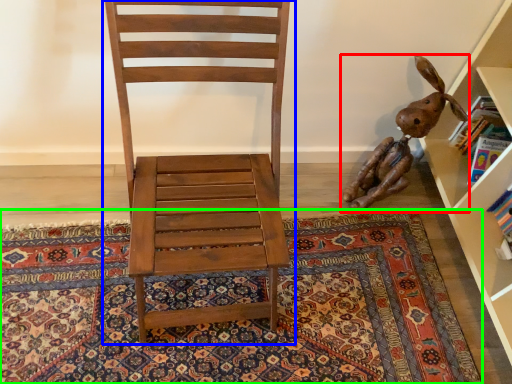
Question: Which object is positioned closest to toy (highlighted by a red box)? Select from chair (highlighted by a blue box) and mat (highlighted by a green box).

Choices:
 (A) chair
 (B) mat

Answer: (B)